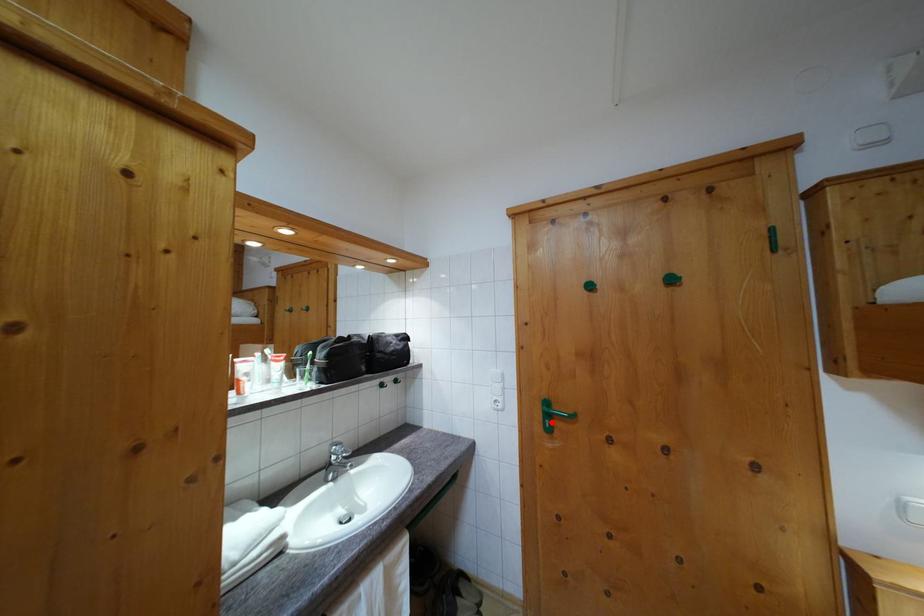
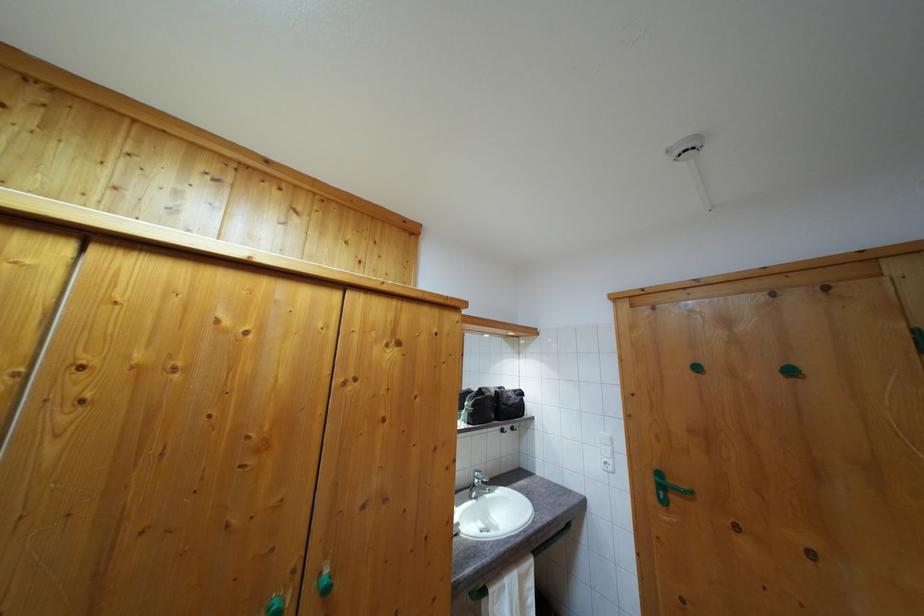
Where in the second image is the point corresponding to the highlighted location from the first image?

(664, 493)